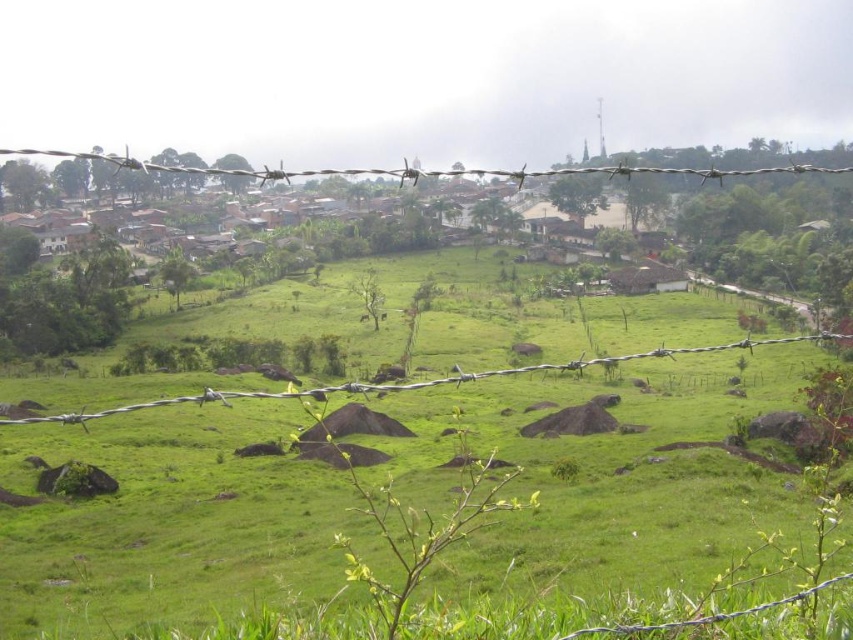
Who is positioned more to the right, green grassy field at center or silver barbed wire at upper center?

Positioned to the right is silver barbed wire at upper center.

You are a GUI agent. You are given a task and a screenshot of the screen. Output one action in this format:
    pyautogui.click(x=<x>, y=<y>)
    Task: Click on the green grassy field at center
    
    Given the screenshot: What is the action you would take?
    [x=601, y=468]

Where is `green grassy field at center`? green grassy field at center is located at coordinates (601, 468).